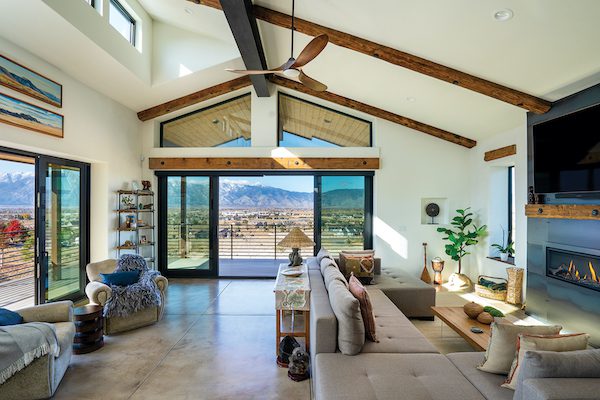
Identify the location of fire in fireplace. The height and width of the screenshot is (400, 600). (591, 270).